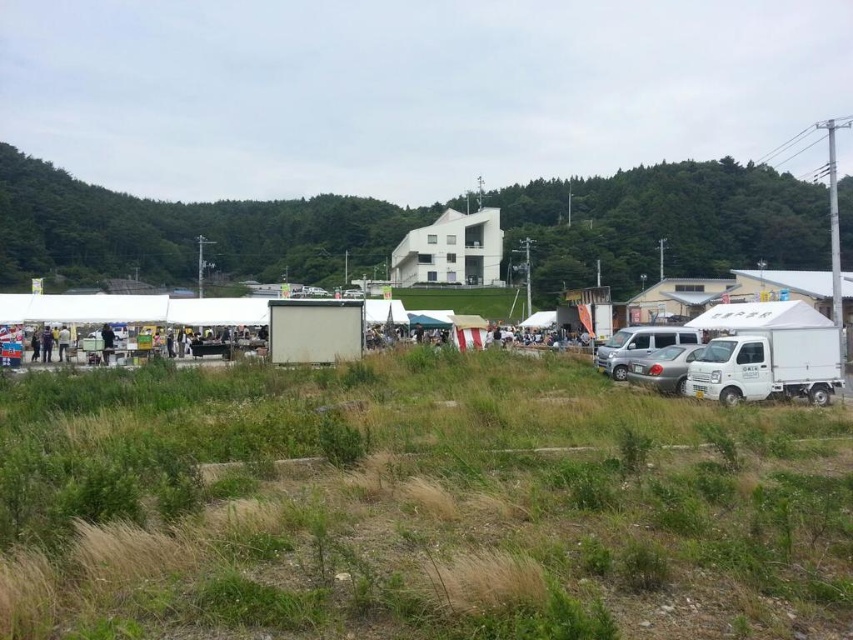
You are standing in the grassy field and want to walk to a specific location. You have two points to choose from. Which point, point 1 at coordinates point (109,339) or point 2 at coordinates point (30,346), is closer to you?

Point 1 at coordinates point (109,339) is closer to you than point 2 at coordinates point (30,346).

You are a photographer standing in the middle of the grassy field. You want to take a picture of the white matte truck at lower right and the dark gray fabric jacket at lower left. Which object should you focus on first if you want to capture both in the same frame without moving your camera?

The white matte truck at lower right has a lesser height compared to dark gray fabric jacket at lower left. Therefore, you should focus on the white matte truck at lower right first since it is closer to you, allowing both objects to be in focus within the same frame.

You are a photographer standing at the edge of the grassy field. You want to take a photo of the white fabric tent at lower left and the dark gray fabric jacket at lower left. Which object should you focus on first if you want to capture both in your shot without moving your camera?

The white fabric tent at lower left is taller than the dark gray fabric jacket at lower left, so you should focus on the white fabric tent at lower left first to ensure both are in focus.